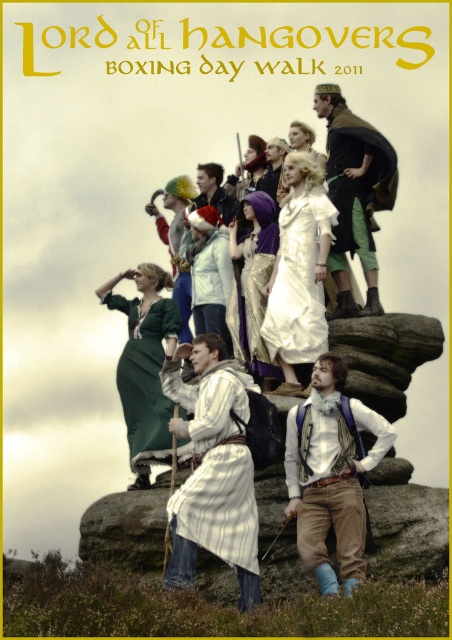
You are a photographer taking a picture of the light brown corduroy pants at center and the white satin dress at center in the poster. Which costume will appear larger in the photo?

The light brown corduroy pants at center will appear larger in the photo because it is closer to the viewer than the white satin dress at center.

Consider the image. In the promotional poster for the Lord of All Hangovers Boxing Day Walk 2011, there are two central figures dressed in light brown corduroy pants at center and a white satin dress at center. Which of these two costumes is located lower in the image?

The light brown corduroy pants at center is positioned under the white satin dress at center, so it is lower in the image.

You are a photographer at the event and need to capture a photo of both the white striped cloth at center and the green velvet dress at center in the same frame. Your camera has a maximum focus range of 10 meters. Can you fit both subjects within the camera focus range?

The white striped cloth at center is 12.05 meters away from the green velvet dress at center. Since the distance between them exceeds the camera focus range of 10 meters, you cannot fit both subjects within the camera focus range.